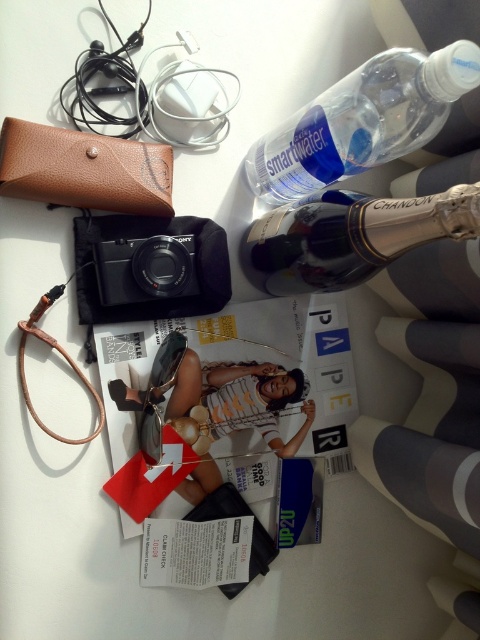
Question: In this image, where is matte paper magazine at center located relative to shiny silver champagne bottle at upper right?

Choices:
 (A) below
 (B) above

Answer: (A)

Question: Does shiny silver champagne bottle at upper right have a lesser width compared to black matte camera at center?

Choices:
 (A) yes
 (B) no

Answer: (B)

Question: Which object appears closest to the camera in this image?

Choices:
 (A) matte paper magazine at center
 (B) transparent plastic bottle at upper right

Answer: (B)

Question: Is the position of transparent plastic bottle at upper right less distant than that of black matte camera at center?

Choices:
 (A) yes
 (B) no

Answer: (A)

Question: Which object is positioned closest to the transparent plastic bottle at upper right?

Choices:
 (A) shiny silver champagne bottle at upper right
 (B) black matte camera at center
 (C) matte paper magazine at center

Answer: (A)

Question: Which point is farther to the camera?

Choices:
 (A) matte paper magazine at center
 (B) transparent plastic bottle at upper right

Answer: (A)